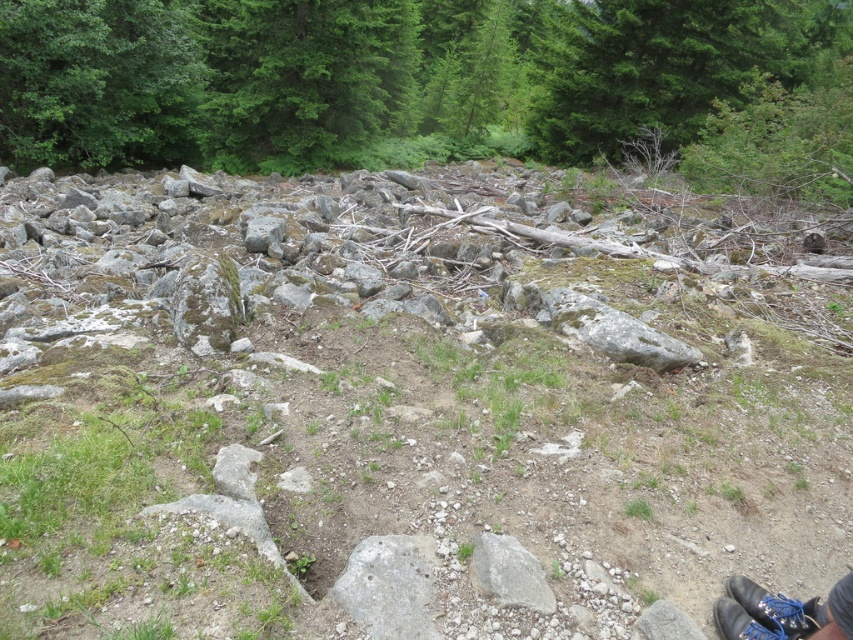
You are a hiker trying to navigate through the rugged terrain. You need to pass between the gray rock pile at center and the green leafy tree at upper center. Can you estimate if the space between them is wide enough for a standard backpack?

The gray rock pile at center has a lesser width compared to green leafy tree at upper center. However, without specific measurements of the space between them, it is difficult to determine if it is wide enough for a standard backpack. You may need to assess the actual distance on site.

You are standing in the forest scene described. You want to walk from your current position to the point at coordinates point (755,621). There is an obstacle at point (288,305). Will you encounter the obstacle before reaching your destination?

Yes, you will encounter the obstacle at point (288,305) before reaching point (755,621) because point (288,305) is closer to you than point (755,621).

You are a hiker who has just spotted the gray rock pile at center and the black leather shoe at lower right in the rugged terrain. Which object would require more effort to move due to its size?

The gray rock pile at center would require more effort to move because it is larger in size than the black leather shoe at lower right.